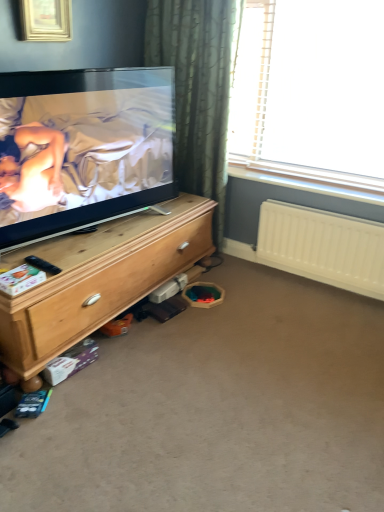
Question: Based on their sizes in the image, would you say wooden chest of drawers at left is bigger or smaller than carpet at lower center?

Choices:
 (A) big
 (B) small

Answer: (A)

Question: In terms of height, does wooden chest of drawers at left look taller or shorter compared to carpet at lower center?

Choices:
 (A) short
 (B) tall

Answer: (B)

Question: Based on their relative distances, which object is farther from the matte black tv at left?

Choices:
 (A) wooden chest of drawers at left
 (B) carpet at lower center
 (C) transparent plastic window at upper right
 (D) black plastic remote control at lower left
 (E) gold metallic picture frame at upper left

Answer: (B)

Question: Which object is positioned farthest from the black plastic remote control at lower left?

Choices:
 (A) wooden chest of drawers at left
 (B) transparent plastic window at upper right
 (C) carpet at lower center
 (D) gold metallic picture frame at upper left
 (E) matte black tv at left

Answer: (B)